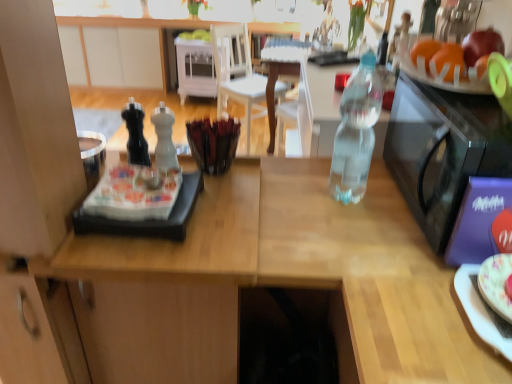
Find the location of a particular element. free space to the back side of clear plastic bottle at center, acting as the 1th bottle starting from the right is located at coordinates [330, 166].